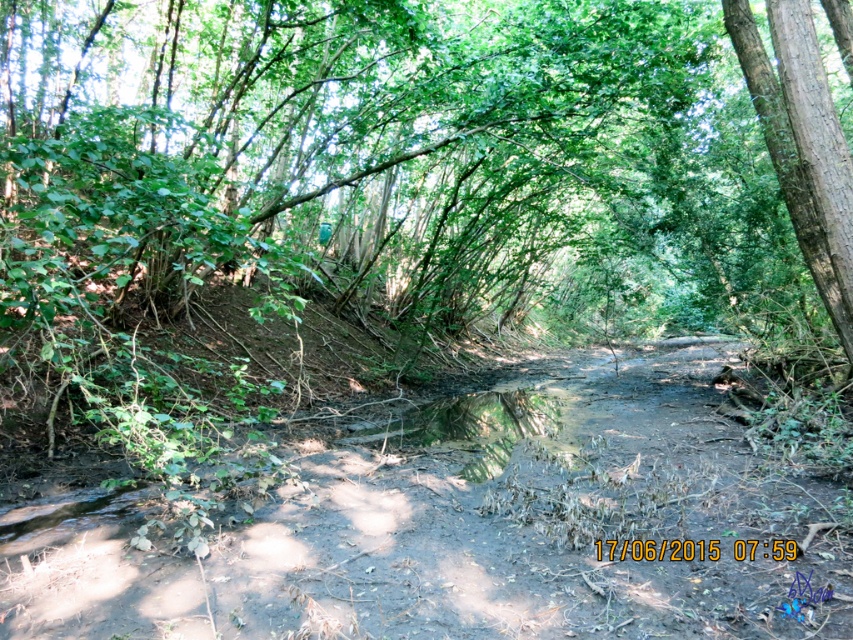
Consider the image. You are a hiker trying to decide whether to walk on the brown dirt track at center or around the smooth brown tree trunk at right. Which path has a lower height obstacle?

The brown dirt track at center has a lesser height compared to the smooth brown tree trunk at right, so the path on the brown dirt track at center has a lower height obstacle.

You are standing at the point labeled point [381,486]. You want to walk to the other side of the stream. The stream is 4.38 meters wide. If your maximum jump distance is 4 meters, can you safely cross the stream in one jump?

The stream is 4.38 meters wide, which is wider than your maximum jump distance of 4 meters. Therefore, you cannot safely cross the stream in one jump.

You are planning to walk along the brown dirt track at center and want to reach the smooth brown tree trunk at right. Based on the scene, which direction should you face to walk towards the tree trunk?

The brown dirt track at center is in front of the smooth brown tree trunk at right, so you should face towards the right direction to walk towards the tree trunk.